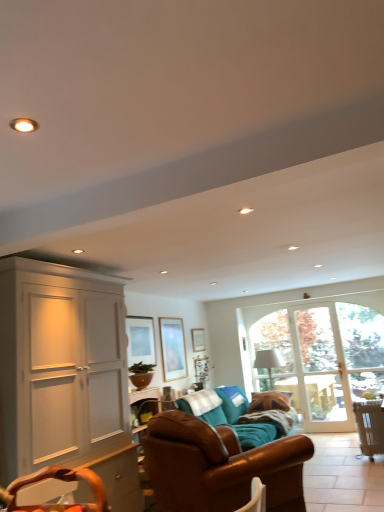
Question: From a real-world perspective, is white matte cabinet at left physically below brown leather couch at center, the first studio couch viewed from the front?

Choices:
 (A) no
 (B) yes

Answer: (A)

Question: Can brown leather couch at center, the first studio couch viewed from the front, be found inside white matte cabinet at left?

Choices:
 (A) no
 (B) yes

Answer: (A)

Question: From the image's perspective, is white matte cabinet at left on top of brown leather couch at center, the first studio couch viewed from the front?

Choices:
 (A) no
 (B) yes

Answer: (B)

Question: From the image's perspective, is white matte cabinet at left beneath brown leather couch at center, the first studio couch viewed from the front?

Choices:
 (A) yes
 (B) no

Answer: (B)

Question: Is white matte cabinet at left bigger than brown leather couch at center, the first studio couch viewed from the front?

Choices:
 (A) no
 (B) yes

Answer: (B)

Question: From the image's perspective, relative to clear glass door at right, is green matte plant at center above or below?

Choices:
 (A) below
 (B) above

Answer: (B)

Question: Considering the positions of point (145, 374) and point (309, 312), is point (145, 374) closer or farther from the camera than point (309, 312)?

Choices:
 (A) closer
 (B) farther

Answer: (A)

Question: Is green matte plant at center inside or outside of clear glass door at right?

Choices:
 (A) outside
 (B) inside

Answer: (A)

Question: Is green matte plant at center wider or thinner than clear glass door at right?

Choices:
 (A) wide
 (B) thin

Answer: (A)

Question: Is brown leather couch at center, marked as the 1th studio couch in a back-to-front arrangement, inside the boundaries of brown leather couch at center, the first studio couch viewed from the front, or outside?

Choices:
 (A) inside
 (B) outside

Answer: (B)

Question: Is brown leather couch at center, marked as the second studio couch in a front-to-back arrangement, wider or thinner than brown leather couch at center, the first studio couch viewed from the front?

Choices:
 (A) wide
 (B) thin

Answer: (A)

Question: Is brown leather couch at center, marked as the 1th studio couch in a back-to-front arrangement, in front of or behind brown leather couch at center, the first studio couch viewed from the front, in the image?

Choices:
 (A) behind
 (B) front

Answer: (A)

Question: From the image's perspective, is brown leather couch at center, marked as the 1th studio couch in a back-to-front arrangement, above or below brown leather couch at center, the 2th studio couch in the back-to-front sequence?

Choices:
 (A) above
 (B) below

Answer: (B)

Question: In terms of height, does wooden picture frame at center, the 3th picture frame in the left-to-right sequence, look taller or shorter compared to brown leather chair at lower right?

Choices:
 (A) tall
 (B) short

Answer: (B)

Question: Looking at the image, does wooden picture frame at center, positioned as the 1th picture frame in back-to-front order, seem bigger or smaller compared to brown leather chair at lower right?

Choices:
 (A) small
 (B) big

Answer: (A)